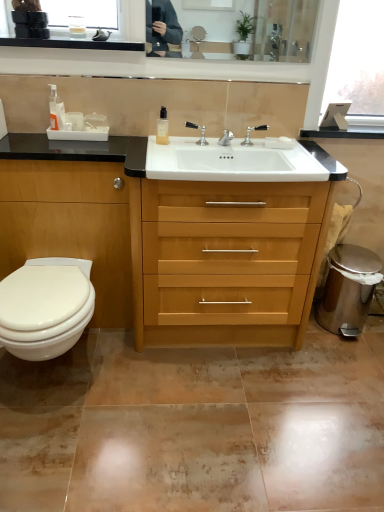
In order to click on free location in front of white glossy toilet at lower left in this screenshot , I will do `click(62, 458)`.